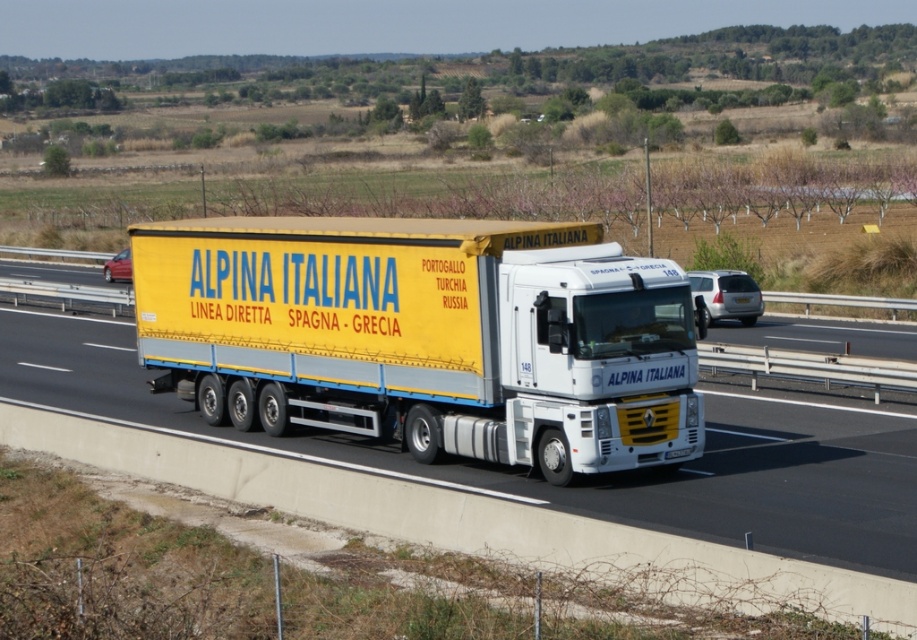
Question: Is yellow matte trailer truck at center to the left of yellow matte truck at center from the viewer's perspective?

Choices:
 (A) no
 (B) yes

Answer: (B)

Question: Is yellow matte trailer truck at center smaller than yellow matte truck at center?

Choices:
 (A) no
 (B) yes

Answer: (B)

Question: Which object appears farthest from the camera in this image?

Choices:
 (A) yellow matte truck at center
 (B) yellow matte trailer truck at center

Answer: (B)

Question: Among these points, which one is farthest from the camera?

Choices:
 (A) (582, 508)
 (B) (326, 356)

Answer: (B)

Question: Does yellow matte trailer truck at center have a greater width compared to yellow matte truck at center?

Choices:
 (A) no
 (B) yes

Answer: (A)

Question: Which object is farther from the camera taking this photo?

Choices:
 (A) yellow matte trailer truck at center
 (B) yellow matte truck at center

Answer: (A)